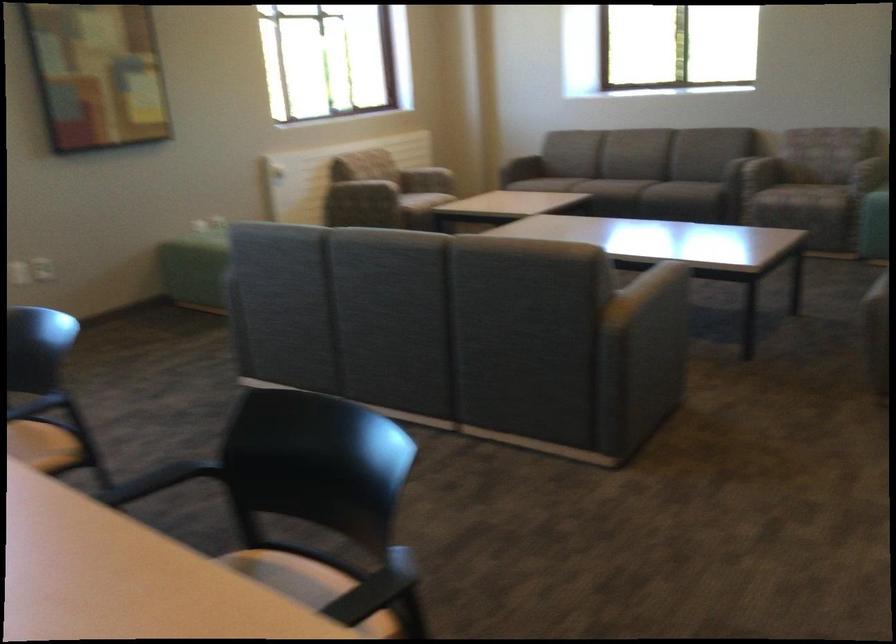
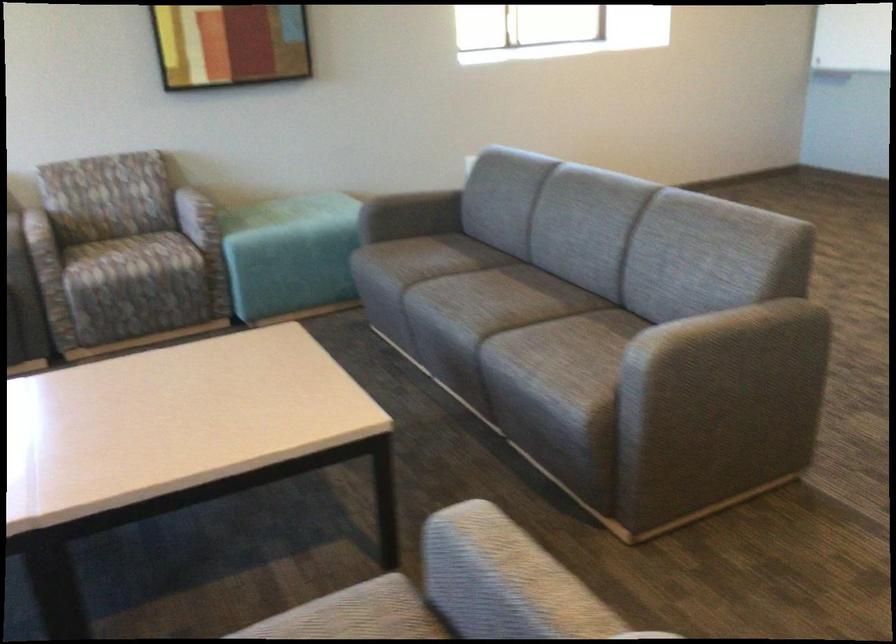
The point at (773, 180) is marked in the first image. Where is the corresponding point in the second image?

(125, 259)